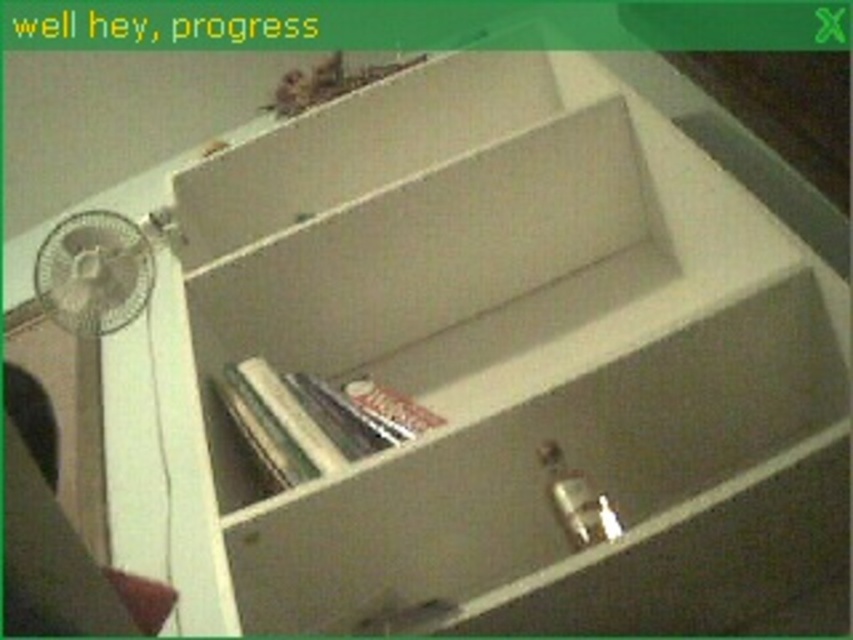
Measure the distance between hardcover book at center and camera.

91.42 centimeters

Is point (396, 410) in front of point (106, 257)?

That is True.

The image size is (853, 640). Describe the element at coordinates (315, 419) in the screenshot. I see `hardcover book at center` at that location.

Locate an element on the screen. This screenshot has height=640, width=853. hardcover book at center is located at coordinates (315, 419).